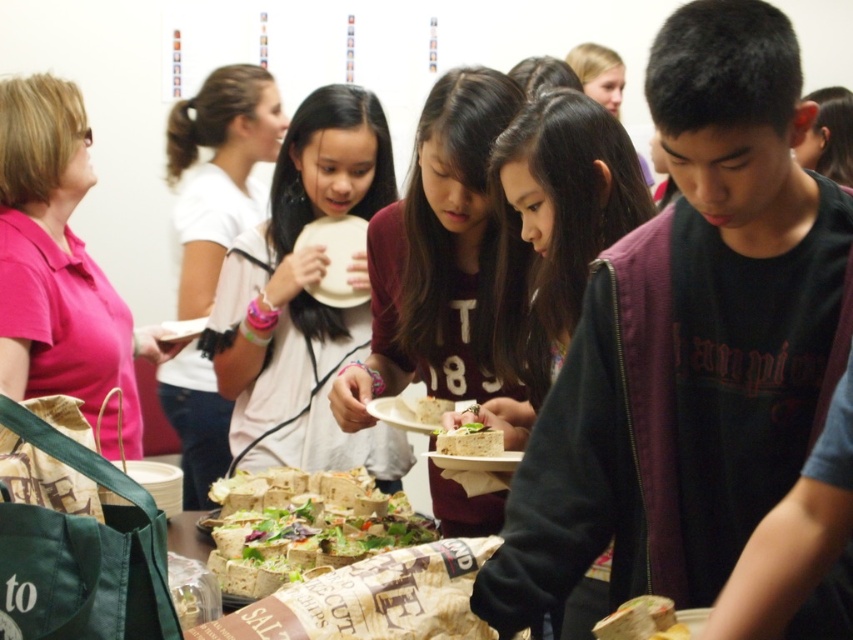
Question: Is pink fabric shirt at left to the right of matte brown sandwich at center from the viewer's perspective?

Choices:
 (A) yes
 (B) no

Answer: (B)

Question: Which object is positioned closest to the crusty bread at center?

Choices:
 (A) matte brown sandwich at center
 (B) white matte paper plate at center
 (C) pink fabric shirt at left

Answer: (A)

Question: Is maroon jersey at center thinner than green leafy salad at center?

Choices:
 (A) yes
 (B) no

Answer: (B)

Question: Which object appears closest to the camera in this image?

Choices:
 (A) white matte paper plate at upper center
 (B) matte brown sweater at center

Answer: (B)

Question: Which point is farther to the camera?

Choices:
 (A) white matte paper plate at upper center
 (B) pink fabric shirt at left

Answer: (A)

Question: Can you confirm if matte brown sweater at center is thinner than crusty bread at center?

Choices:
 (A) no
 (B) yes

Answer: (B)